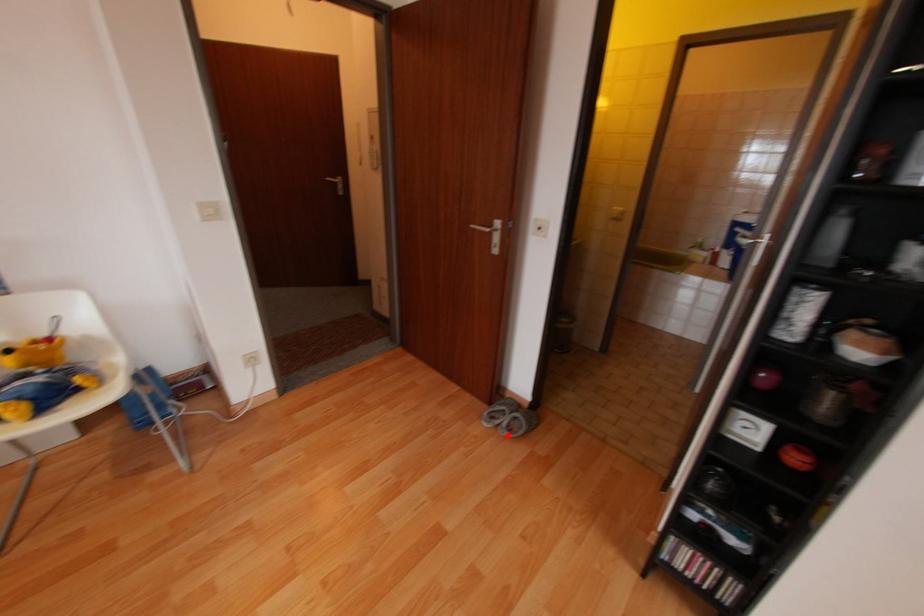
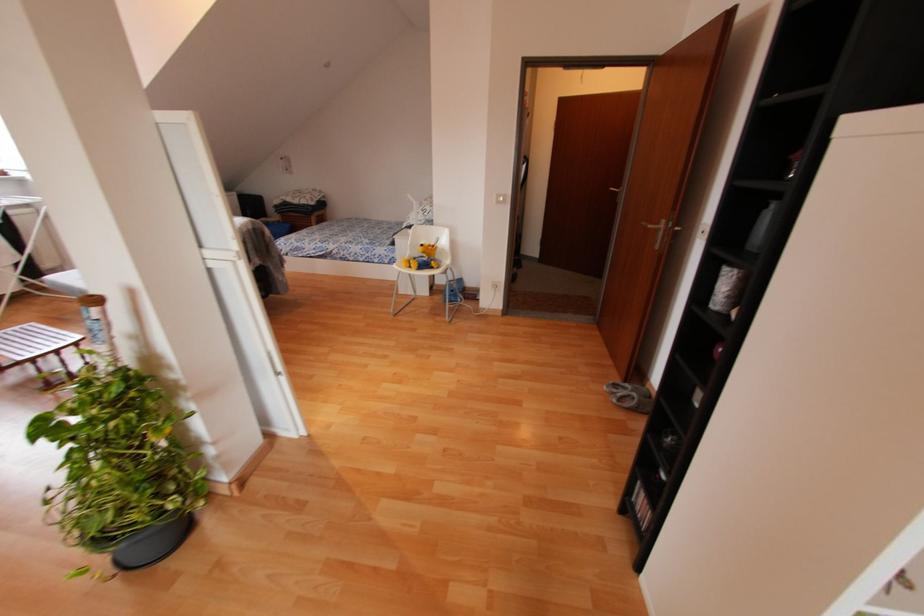
Find the pixel in the second image that matches the highlighted location in the first image.

(613, 400)